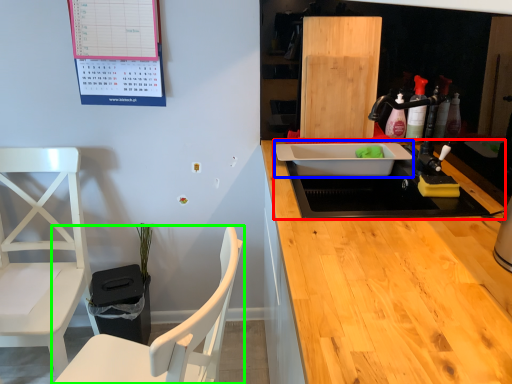
Question: Which object is positioned farthest from sink (highlighted by a red box)? Select from sink (highlighted by a blue box) and chair (highlighted by a green box).

Choices:
 (A) sink
 (B) chair

Answer: (B)